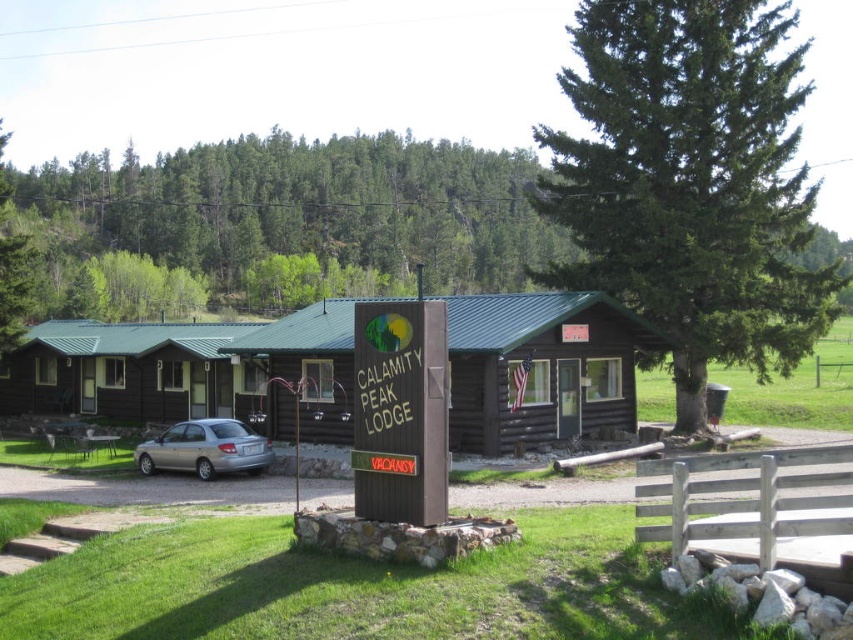
Who is more distant from viewer, (486, 154) or (67, 406)?

Point (486, 154)

Is green leafy tree at upper center taller than brown log cabin at left?

Indeed, green leafy tree at upper center has a greater height compared to brown log cabin at left.

Identify the location of green leafy tree at upper center. This screenshot has width=853, height=640. (302, 209).

Between point (231, 435) and point (80, 445), which one is positioned behind?

Point (80, 445)

Can you confirm if satin silver sedan at lower left is thinner than brown wooden picnic table at lower left?

Indeed, satin silver sedan at lower left has a lesser width compared to brown wooden picnic table at lower left.

Who is more distant from viewer, [171,454] or [48,422]?

The point [48,422] is more distant.

Where is `satin silver sedan at lower left`? satin silver sedan at lower left is located at coordinates (206, 449).

Can you confirm if green leafy tree at upper center is shorter than satin silver sedan at lower left?

In fact, green leafy tree at upper center may be taller than satin silver sedan at lower left.

Which is above, green leafy tree at upper center or satin silver sedan at lower left?

green leafy tree at upper center

Is point (85, 166) more distant than point (263, 452)?

Yes, point (85, 166) is farther from viewer.

The height and width of the screenshot is (640, 853). In order to click on green leafy tree at upper center in this screenshot , I will do `click(302, 209)`.